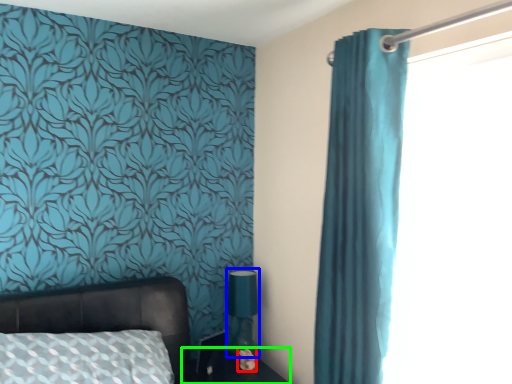
Question: Which object is positioned farthest from flower (highlighted by a red box)? Select from table lamp (highlighted by a blue box) and side table (highlighted by a green box).

Choices:
 (A) table lamp
 (B) side table

Answer: (A)